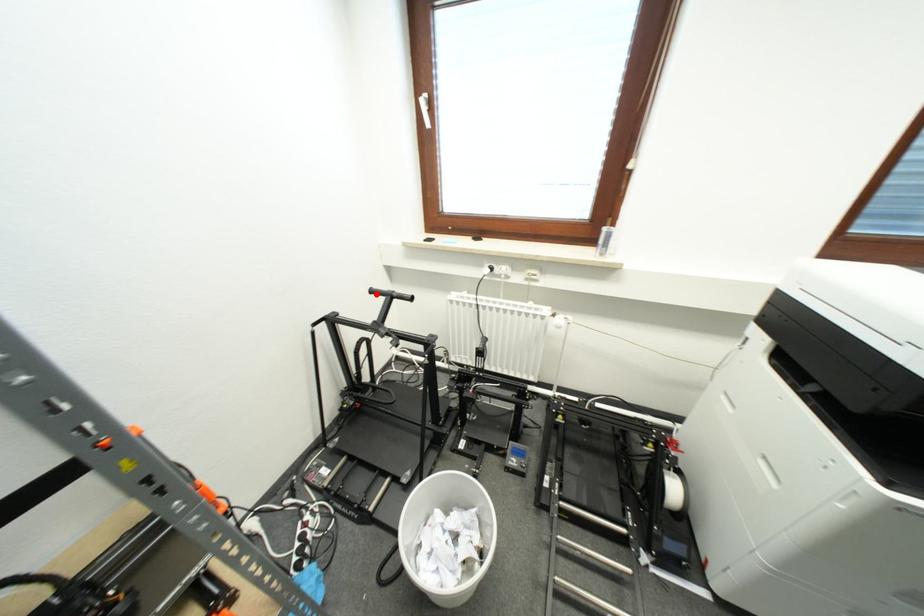
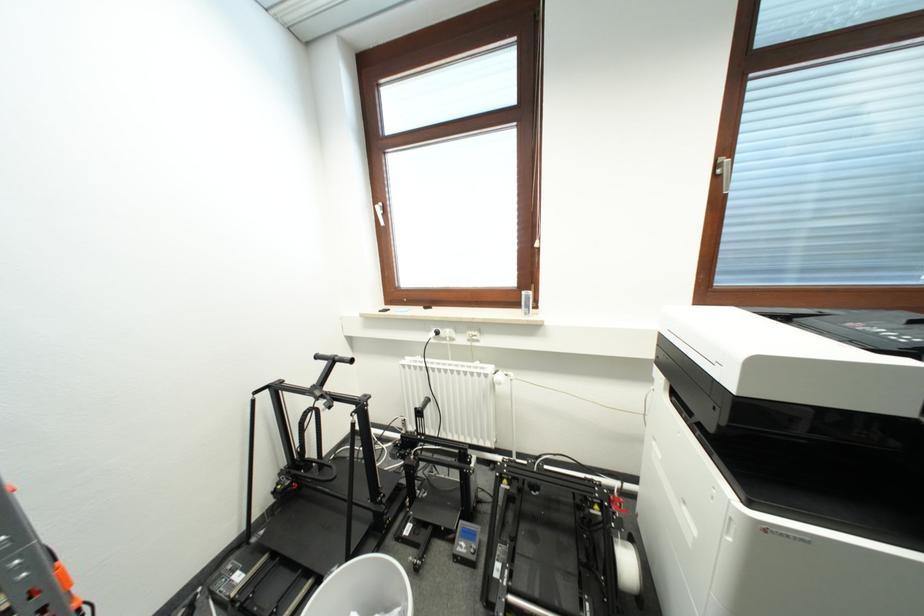
The point at the highlighted location is marked in the first image. Where is the corresponding point in the second image?

(322, 360)